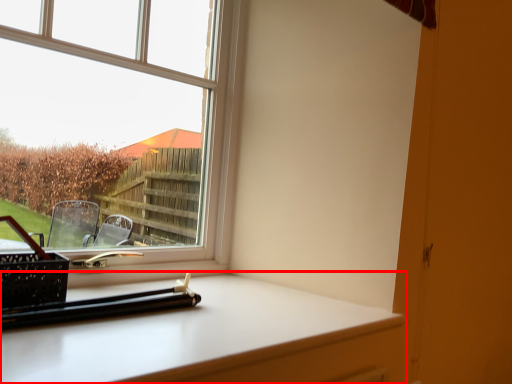
Question: From the image's perspective, considering the relative positions of computer desk (annotated by the red box) and window in the image provided, where is computer desk (annotated by the red box) located with respect to the staircase?

Choices:
 (A) below
 (B) above

Answer: (A)